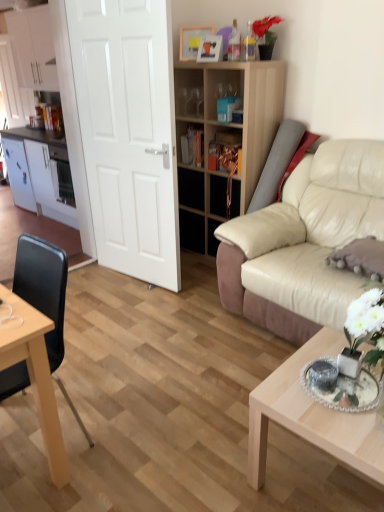
I want to click on free point below light wood/texture coffee table at lower right (from a real-world perspective), so click(328, 480).